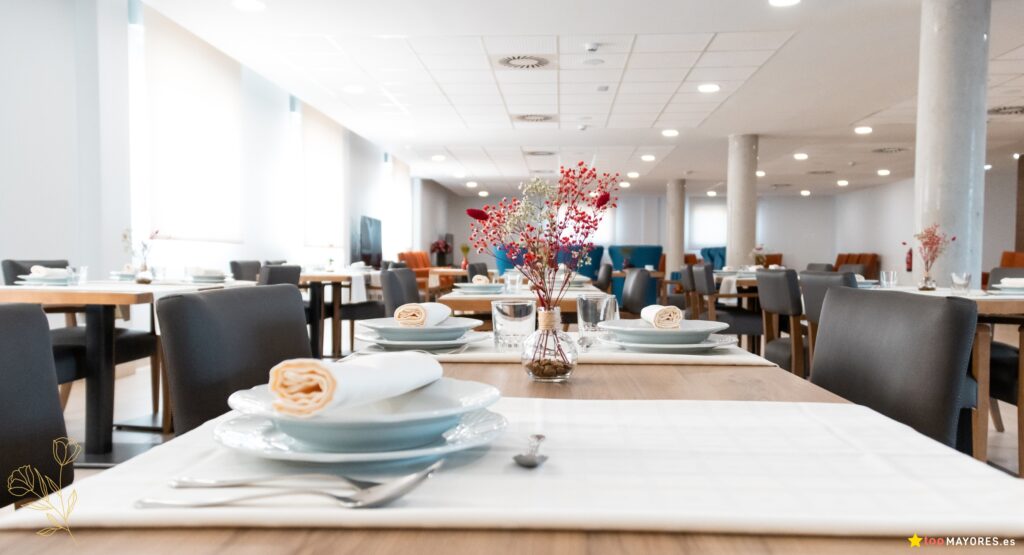
Image resolution: width=1024 pixels, height=555 pixels. I want to click on visible cutlery, so click(348, 502), click(346, 476), click(529, 451), click(580, 340).